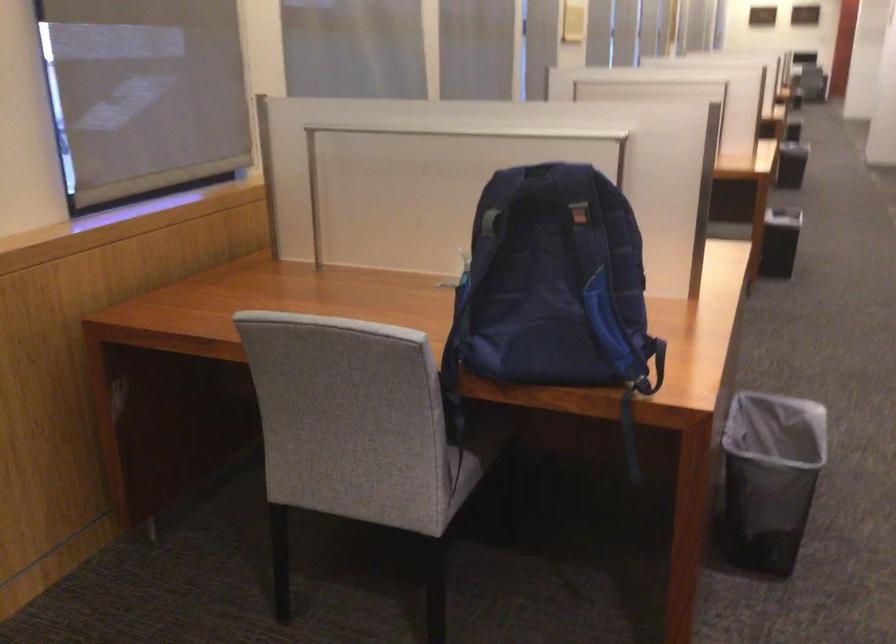
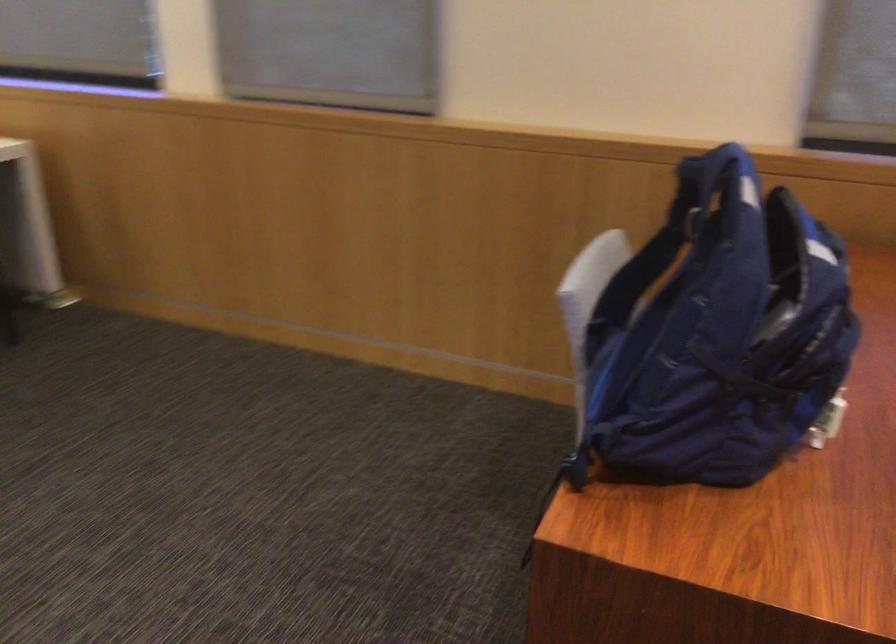
Locate, in the second image, the point that corresponds to point 558,205 in the first image.

(687, 216)